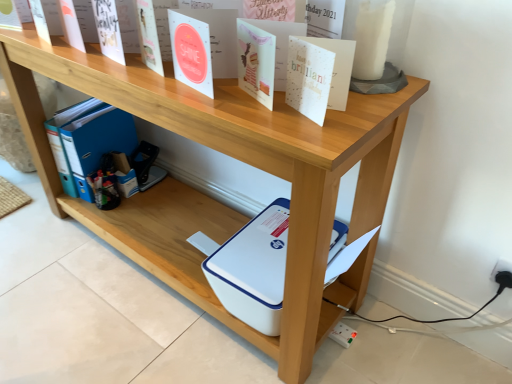
Question: Is white paper at upper center, positioned as the first paperback book in front-to-back order, taller than white plastic electric outlet at lower right?

Choices:
 (A) no
 (B) yes

Answer: (B)

Question: Is white paper at upper center, which is the 2th paperback book from back to front, outside white plastic electric outlet at lower right?

Choices:
 (A) yes
 (B) no

Answer: (A)

Question: Considering the relative sizes of white paper at upper center, the second paperback book viewed from the left, and white plastic electric outlet at lower right in the image provided, is white paper at upper center, the second paperback book viewed from the left, thinner than white plastic electric outlet at lower right?

Choices:
 (A) yes
 (B) no

Answer: (B)

Question: Does white paper at upper center, which is the 1th paperback book in bottom-to-top order, appear on the left side of white plastic electric outlet at lower right?

Choices:
 (A) no
 (B) yes

Answer: (B)

Question: From a real-world perspective, is white paper at upper center, the 2th paperback book viewed from the top, located beneath white plastic electric outlet at lower right?

Choices:
 (A) no
 (B) yes

Answer: (A)

Question: Is white paper at upper center, the 2th paperback book viewed from the top, at the right side of white plastic electric outlet at lower right?

Choices:
 (A) yes
 (B) no

Answer: (B)

Question: From a real-world perspective, does white matte paper at upper center, which ranks as the second paperback book in right-to-left order, sit lower than white plastic electric outlet at lower right?

Choices:
 (A) yes
 (B) no

Answer: (B)

Question: Does white matte paper at upper center, which ranks as the second paperback book in right-to-left order, have a larger size compared to white plastic electric outlet at lower right?

Choices:
 (A) yes
 (B) no

Answer: (A)

Question: From the image's perspective, is white matte paper at upper center, marked as the first paperback book in a top-to-bottom arrangement, over white plastic electric outlet at lower right?

Choices:
 (A) no
 (B) yes

Answer: (B)

Question: Is white matte paper at upper center, which is the 1th paperback book from back to front, oriented away from white plastic electric outlet at lower right?

Choices:
 (A) no
 (B) yes

Answer: (A)

Question: Is white matte paper at upper center, marked as the first paperback book in a top-to-bottom arrangement, outside white plastic electric outlet at lower right?

Choices:
 (A) yes
 (B) no

Answer: (A)

Question: Is white matte paper at upper center, which ranks as the second paperback book in right-to-left order, next to white plastic electric outlet at lower right?

Choices:
 (A) yes
 (B) no

Answer: (B)

Question: Does white plastic electric outlet at lower right contain white paper at upper center, the 1th paperback book positioned from the right?

Choices:
 (A) no
 (B) yes

Answer: (A)